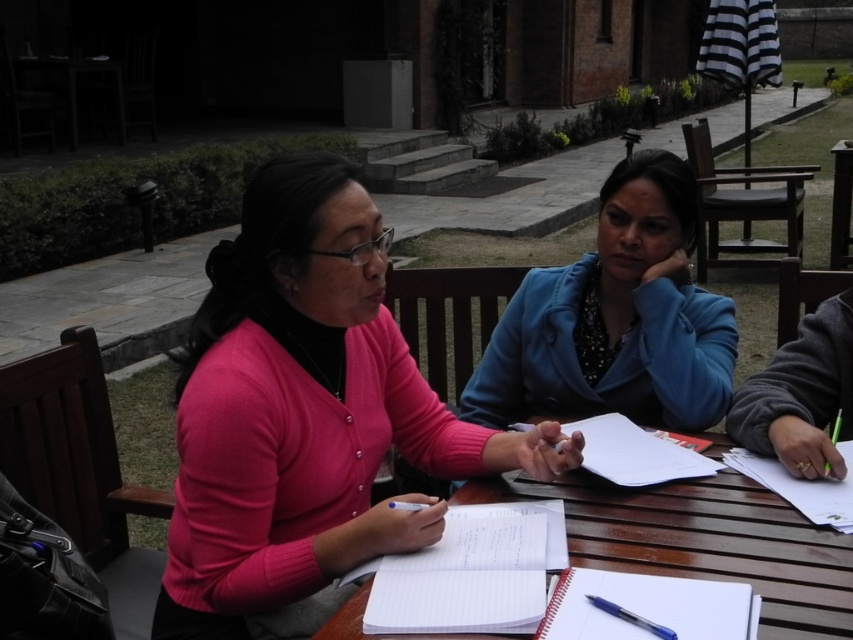
Question: Among these objects, which one is nearest to the camera?

Choices:
 (A) blue fabric jacket at center
 (B) white paper notebook at center

Answer: (B)

Question: Does wooden table at center have a larger size compared to white paper at center?

Choices:
 (A) no
 (B) yes

Answer: (B)

Question: Which object is positioned farthest from the white paper at center?

Choices:
 (A) blue fabric jacket at center
 (B) spiral notebook at lower center
 (C) wooden table at center
 (D) white paper notebook at center

Answer: (B)

Question: Which object appears closest to the camera in this image?

Choices:
 (A) pink sweater at center
 (B) blue plastic pen at lower center
 (C) white paper at center
 (D) wooden table at center

Answer: (B)

Question: Can you confirm if pink sweater at center is wider than white paper notebook at center?

Choices:
 (A) yes
 (B) no

Answer: (A)

Question: Does white paper notebook at center have a larger size compared to spiral notebook at lower center?

Choices:
 (A) yes
 (B) no

Answer: (A)